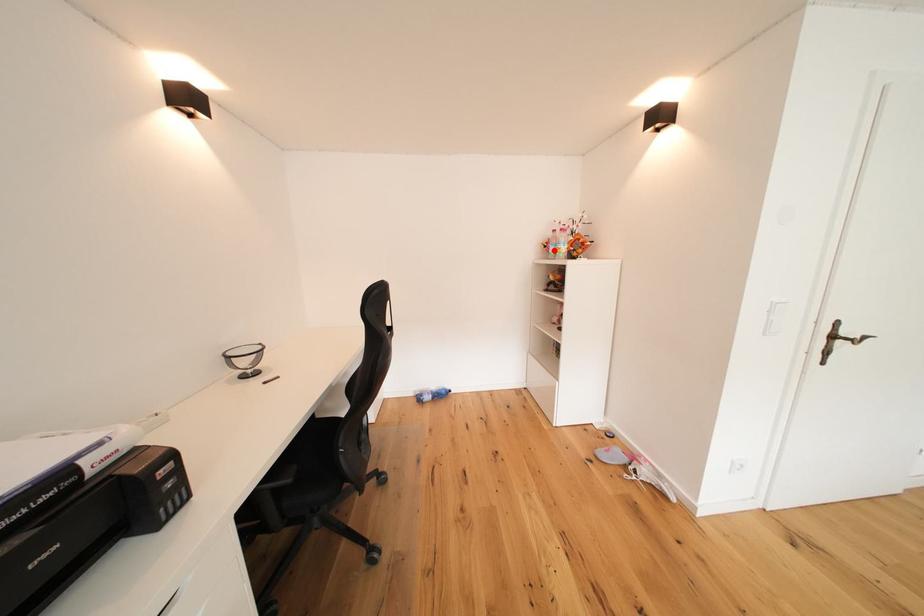
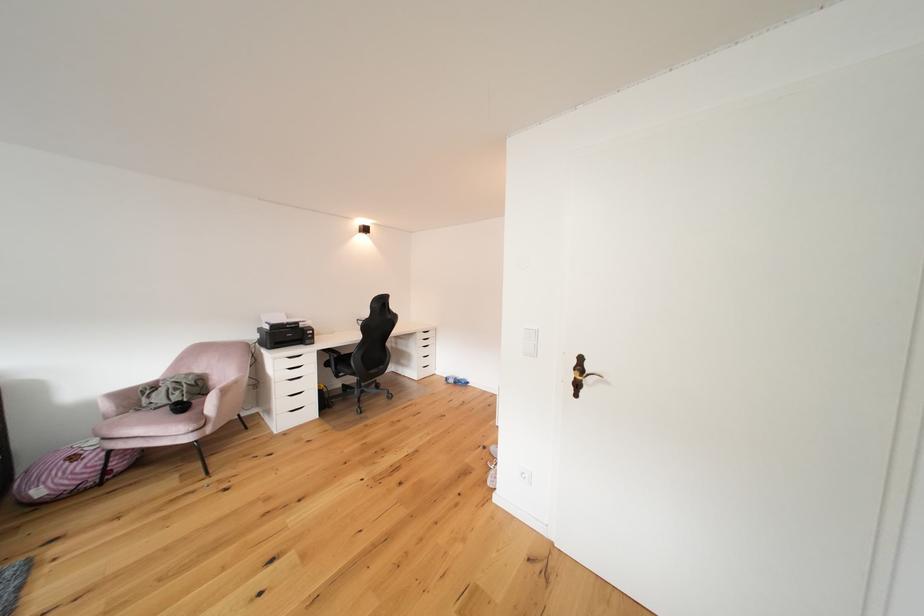
Question: I am providing you with two images of the same scene from different viewpoints. A red point is marked on the first image. Can you still see the location of the red point in image 2?

Choices:
 (A) Yes
 (B) No

Answer: (B)